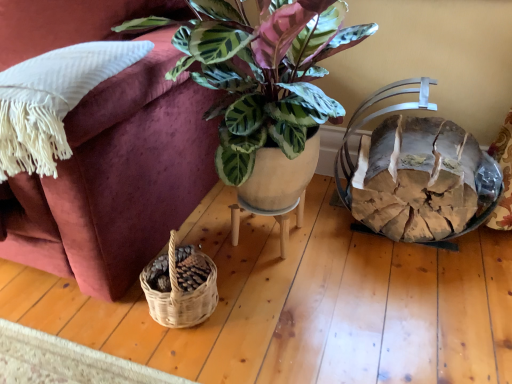
What do you see at coordinates (53, 100) in the screenshot?
I see `white fringed pillow at left` at bounding box center [53, 100].

The image size is (512, 384). In order to click on rustic wood log basket at right in this screenshot , I will do `click(417, 172)`.

Considering the positions of objects matte ceramic pot at center and white fringed pillow at left in the image provided, who is behind, matte ceramic pot at center or white fringed pillow at left?

matte ceramic pot at center is behind.

Is matte ceramic pot at center oriented away from white fringed pillow at left?

matte ceramic pot at center is not turned away from white fringed pillow at left.

Based on the photo, considering the sizes of objects matte ceramic pot at center and white fringed pillow at left in the image provided, who is taller, matte ceramic pot at center or white fringed pillow at left?

With more height is white fringed pillow at left.

Measure the distance from matte ceramic pot at center to white fringed pillow at left.

matte ceramic pot at center is 25.05 inches away from white fringed pillow at left.

From a real-world perspective, is rustic wood log basket at right above or below matte ceramic plant at center?

rustic wood log basket at right is situated lower than matte ceramic plant at center in the real world.

Is rustic wood log basket at right taller or shorter than matte ceramic plant at center?

Clearly, rustic wood log basket at right is shorter compared to matte ceramic plant at center.

Is rustic wood log basket at right to the left of matte ceramic plant at center from the viewer's perspective?

No, rustic wood log basket at right is not to the left of matte ceramic plant at center.

At what (x,y) coordinates should I click in order to perform the action: click on swivel chair directly beneath the matte ceramic plant at center (from a real-world perspective). Please return your answer as a coordinate pair (x, y). Looking at the image, I should click on (417, 172).

In the scene shown: Choose the correct answer: Is white fringed pillow at left inside rustic wood log basket at right or outside it?

white fringed pillow at left is outside rustic wood log basket at right.

Measure the distance between white fringed pillow at left and rustic wood log basket at right.

white fringed pillow at left is 94.15 centimeters away from rustic wood log basket at right.

Based on their positions, is white fringed pillow at left located to the left or right of rustic wood log basket at right?

Clearly, white fringed pillow at left is on the left of rustic wood log basket at right in the image.

Is white fringed pillow at left positioned with its back to rustic wood log basket at right?

That's not correct — white fringed pillow at left is not looking away from rustic wood log basket at right.

Which object is positioned more to the left, rustic wood log basket at right or white fringed pillow at left?

From the viewer's perspective, white fringed pillow at left appears more on the left side.

Does point (431, 215) come in front of point (95, 44)?

That is False.

Is rustic wood log basket at right not within white fringed pillow at left?

Absolutely, rustic wood log basket at right is external to white fringed pillow at left.

Locate an element on the screen. Image resolution: width=512 pixels, height=384 pixels. pillow that appears on the left of rustic wood log basket at right is located at coordinates (53, 100).

How many degrees apart are the facing directions of white fringed pillow at left and matte ceramic plant at center?

There is a 1.37-degree angle between the facing directions of white fringed pillow at left and matte ceramic plant at center.

Between white fringed pillow at left and matte ceramic plant at center, which one appears on the right side from the viewer's perspective?

Positioned to the right is matte ceramic plant at center.

Could you tell me if white fringed pillow at left is turned towards matte ceramic plant at center?

No, white fringed pillow at left does not turn towards matte ceramic plant at center.

This screenshot has height=384, width=512. What are the coordinates of `houseplant on the right side of white fringed pillow at left` in the screenshot? It's located at (262, 72).

Considering the relative sizes of rustic wood log basket at right and matte ceramic pot at center in the image provided, is rustic wood log basket at right wider than matte ceramic pot at center?

Indeed, rustic wood log basket at right has a greater width compared to matte ceramic pot at center.

Are rustic wood log basket at right and matte ceramic pot at center located far from each other?

No, rustic wood log basket at right is not far from matte ceramic pot at center.

Which is closer, (494,166) or (233,237)?

The point (494,166) is more forward.

From a real-world perspective, who is located higher, rustic wood log basket at right or matte ceramic pot at center?

rustic wood log basket at right.

Looking at their sizes, would you say matte ceramic plant at center is wider or thinner than matte ceramic pot at center?

Clearly, matte ceramic plant at center has more width compared to matte ceramic pot at center.

Does matte ceramic plant at center have a smaller size compared to matte ceramic pot at center?

Actually, matte ceramic plant at center might be larger than matte ceramic pot at center.

Image resolution: width=512 pixels, height=384 pixels. Find the location of `houseplant above the matte ceramic pot at center (from a real-world perspective)`. houseplant above the matte ceramic pot at center (from a real-world perspective) is located at coordinates (262, 72).

The width and height of the screenshot is (512, 384). In order to click on table that appears below the white fringed pillow at left (from the image's perspective) in this screenshot , I will do [268, 215].

Identify the location of houseplant on the left of rustic wood log basket at right. (262, 72).

Considering their positions, is matte ceramic plant at center positioned closer to rustic wood log basket at right than white fringed pillow at left?

matte ceramic plant at center lies closer to rustic wood log basket at right than the other object.

From the image, which object appears to be farther from white fringed pillow at left, matte ceramic plant at center or matte ceramic pot at center?

matte ceramic pot at center.

Estimate the real-world distances between objects in this image. Which object is further from matte ceramic plant at center, white fringed pillow at left or matte ceramic pot at center?

matte ceramic pot at center.

When comparing their distances from matte ceramic plant at center, does rustic wood log basket at right or white fringed pillow at left seem closer?

Based on the image, white fringed pillow at left appears to be nearer to matte ceramic plant at center.

From the image, which object appears to be nearer to white fringed pillow at left, matte ceramic plant at center or rustic wood log basket at right?

matte ceramic plant at center is positioned closer to the anchor white fringed pillow at left.

From the image, which object appears to be farther from matte ceramic plant at center, white fringed pillow at left or rustic wood log basket at right?

rustic wood log basket at right is positioned further to the anchor matte ceramic plant at center.

Estimate the real-world distances between objects in this image. Which object is closer to rustic wood log basket at right, white fringed pillow at left or matte ceramic plant at center?

Among the two, matte ceramic plant at center is located nearer to rustic wood log basket at right.

Estimate the real-world distances between objects in this image. Which object is closer to matte ceramic plant at center, rustic wood log basket at right or matte ceramic pot at center?

Based on the image, matte ceramic pot at center appears to be nearer to matte ceramic plant at center.

Where is `table situated between white fringed pillow at left and rustic wood log basket at right from left to right`? table situated between white fringed pillow at left and rustic wood log basket at right from left to right is located at coordinates (268, 215).

Identify the location of pillow positioned between matte ceramic plant at center and matte ceramic pot at center from near to far. The height and width of the screenshot is (384, 512). (53, 100).

Locate an element on the screen. Image resolution: width=512 pixels, height=384 pixels. houseplant situated between white fringed pillow at left and rustic wood log basket at right from left to right is located at coordinates (262, 72).

Locate an element on the screen. This screenshot has height=384, width=512. swivel chair between matte ceramic plant at center and matte ceramic pot at center from front to back is located at coordinates (417, 172).